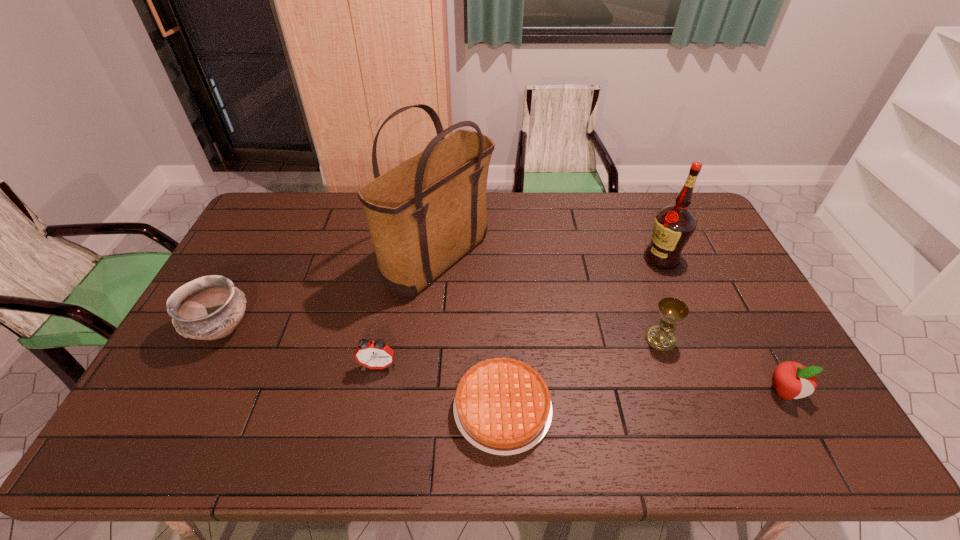
At what (x,y) coordinates should I click in order to perform the action: click on vacant space at the far edge of the desktop. Please return your answer as a coordinate pair (x, y). The width and height of the screenshot is (960, 540). Looking at the image, I should click on (597, 193).

The height and width of the screenshot is (540, 960). What are the coordinates of `free point at the near edge` in the screenshot? It's located at (286, 438).

Locate an element on the screen. The image size is (960, 540). free region at the left edge is located at coordinates (234, 342).

Locate an element on the screen. free region at the far left corner of the desktop is located at coordinates (272, 223).

At what (x,y) coordinates should I click in order to perform the action: click on vacant area between the leftmost object and the second tallest object. Please return your answer as a coordinate pair (x, y). This screenshot has width=960, height=540. Looking at the image, I should click on (442, 294).

Image resolution: width=960 pixels, height=540 pixels. In order to click on free space between the pottery and the tallest object in this screenshot , I will do `click(330, 294)`.

This screenshot has height=540, width=960. Identify the location of empty location between the alcohol and the chalice. (660, 299).

Find the location of a particular element. free space between the pottery and the alarm clock is located at coordinates (300, 347).

Image resolution: width=960 pixels, height=540 pixels. Identify the location of empty space that is in between the alarm clock and the pie. (441, 387).

The width and height of the screenshot is (960, 540). Find the location of `free space that is in between the apple and the alarm clock`. free space that is in between the apple and the alarm clock is located at coordinates (581, 379).